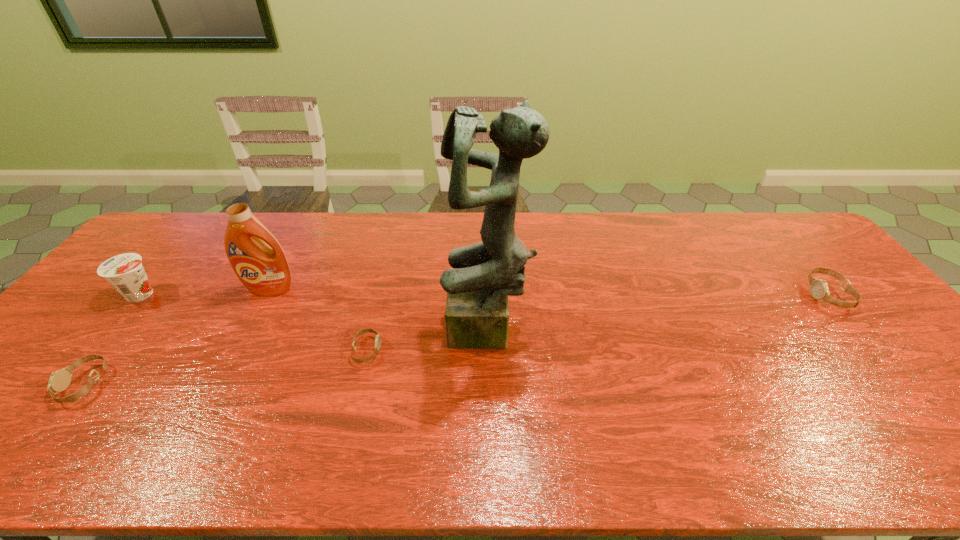
This screenshot has height=540, width=960. In order to click on vacant space situated on the face of the tallest object in this screenshot , I will do `click(294, 333)`.

Locate an element on the screen. This screenshot has height=540, width=960. vacant space located 0.350m on the face of the tallest object is located at coordinates (313, 333).

Where is `free location located on the back of the third tallest object`? The height and width of the screenshot is (540, 960). free location located on the back of the third tallest object is located at coordinates (168, 264).

Identify the location of object that is at the near edge. The width and height of the screenshot is (960, 540). pyautogui.click(x=59, y=380).

The width and height of the screenshot is (960, 540). Find the location of `watch present at the left edge`. watch present at the left edge is located at coordinates (59, 380).

You are a GUI agent. You are given a task and a screenshot of the screen. Output one action in this format:
    pyautogui.click(x=<x>, y=<y>)
    Task: Click on the yogurt present at the left edge
    The height and width of the screenshot is (540, 960).
    Given the screenshot: What is the action you would take?
    pyautogui.click(x=125, y=272)

In order to click on object located in the right edge section of the desktop in this screenshot , I will do [x=819, y=290].

You are a GUI agent. You are given a task and a screenshot of the screen. Output one action in this format:
    pyautogui.click(x=<x>, y=<y>)
    Task: Click on the object at the near left corner
    This screenshot has height=540, width=960.
    Given the screenshot: What is the action you would take?
    pyautogui.click(x=59, y=380)

Locate an element on the screen. The width and height of the screenshot is (960, 540). free region at the far edge is located at coordinates tap(217, 243).

In the image, there is a desktop. Identify the location of vacant space at the near edge. (270, 414).